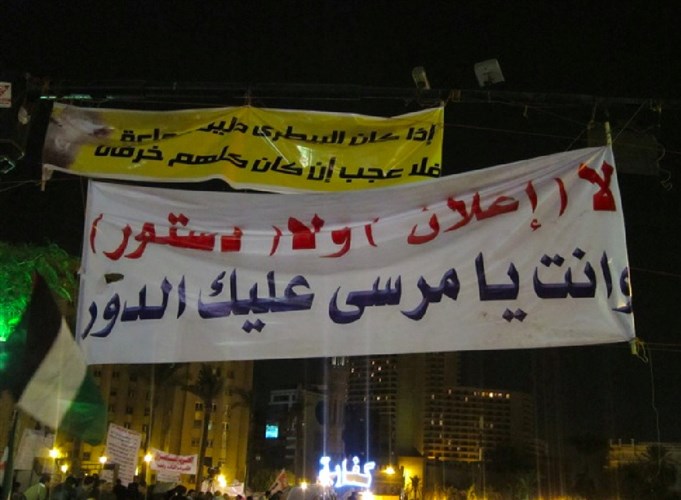
The width and height of the screenshot is (681, 500). Find the location of `bright white lighted display`. bright white lighted display is located at coordinates (372, 473), (330, 471).